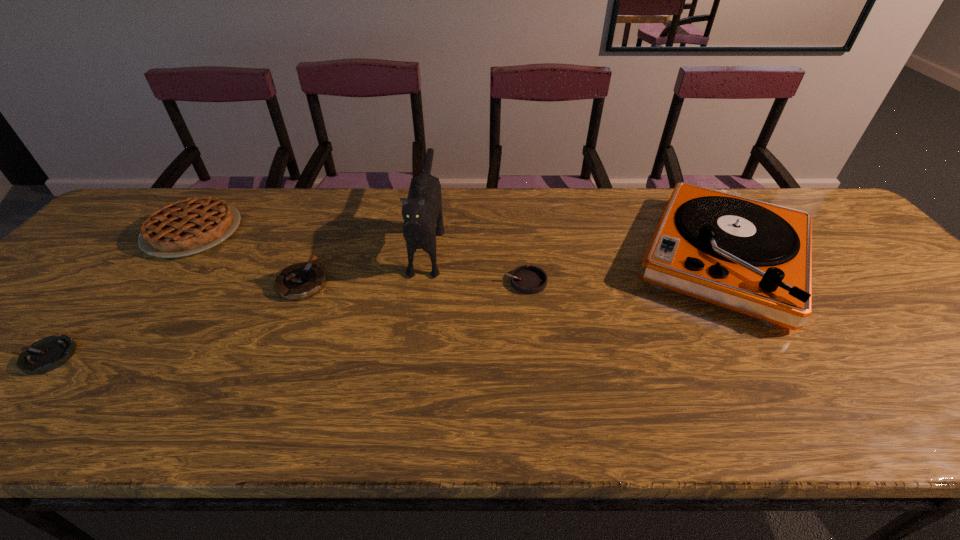
Find the location of a particular element. pie that is positioned at the left edge is located at coordinates (189, 226).

Locate an element on the screen. This screenshot has width=960, height=540. ashtray present at the left edge is located at coordinates (45, 355).

Identify the location of object that is at the right edge. This screenshot has width=960, height=540. (753, 257).

The width and height of the screenshot is (960, 540). I want to click on object at the far left corner, so [189, 226].

This screenshot has height=540, width=960. In order to click on object present at the far right corner in this screenshot , I will do `click(753, 257)`.

At what (x,y) coordinates should I click in order to perform the action: click on free region at the far edge. Please return your answer as a coordinate pair (x, y). Looking at the image, I should click on (395, 214).

At what (x,y) coordinates should I click in order to perform the action: click on vacant space at the near edge. Please return your answer as a coordinate pair (x, y). The height and width of the screenshot is (540, 960). Looking at the image, I should click on (488, 398).

This screenshot has height=540, width=960. What are the coordinates of `blank space at the right edge of the desktop` in the screenshot? It's located at (881, 258).

This screenshot has width=960, height=540. What are the coordinates of `vacant space that's between the third object from left to right and the rightmost object` in the screenshot? It's located at (513, 270).

Identify the location of free spot between the nearest object and the tallest ashtray. This screenshot has width=960, height=540. click(x=176, y=320).